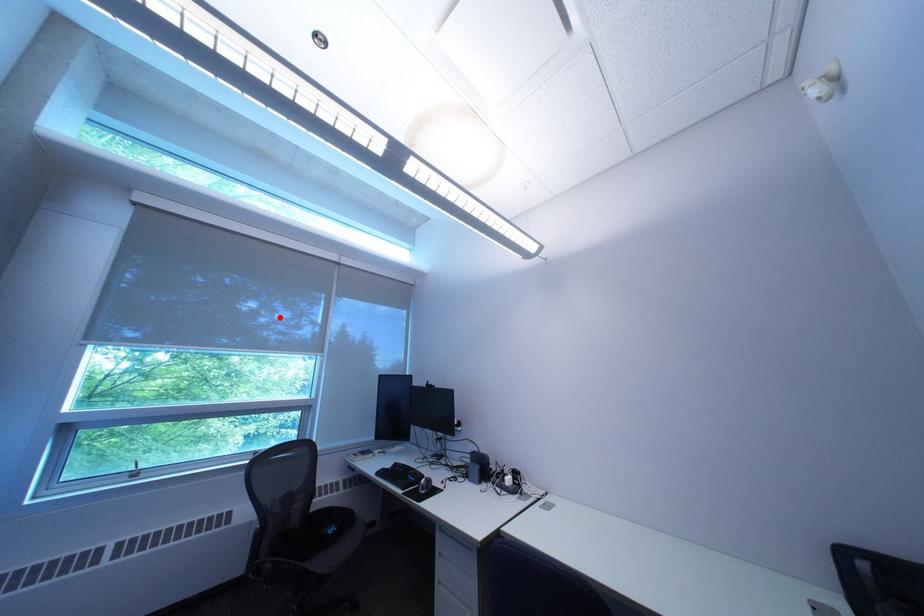
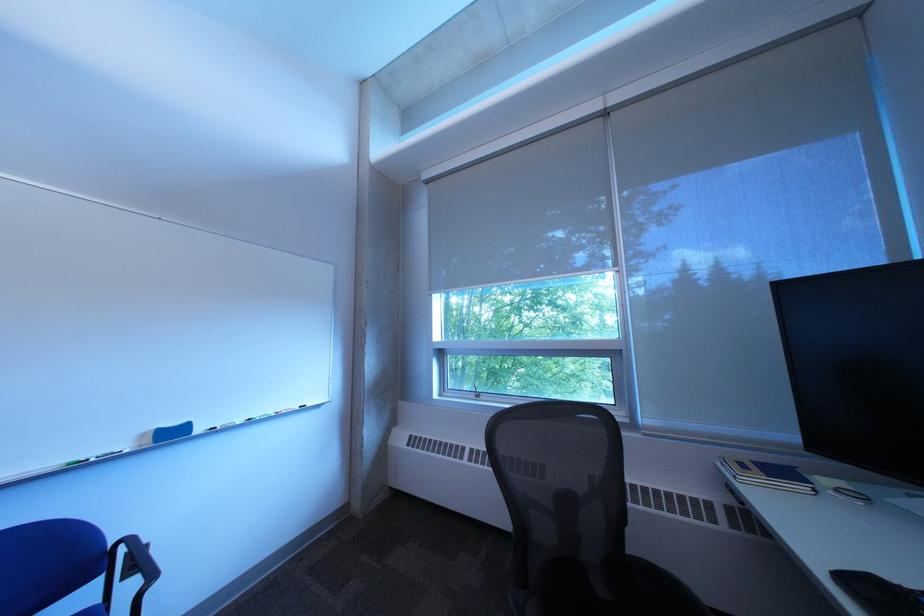
Question: I am providing you with two images of the same scene from different viewpoints. Image1 has a red point marked. In image2, the corresponding 3D location appears at what relative position? Reply with the corresponding letter.

Choices:
 (A) Closer
 (B) Farther

Answer: (A)